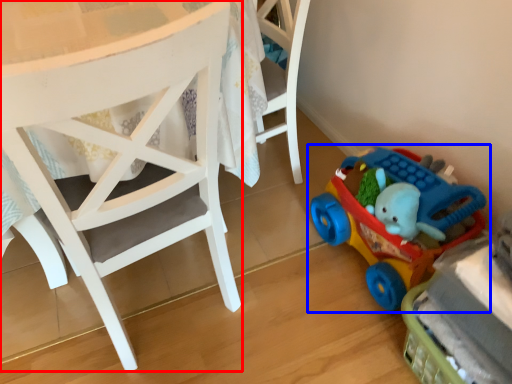
Question: Among these objects, which one is farthest to the camera, chair (highlighted by a red box) or toy (highlighted by a blue box)?

Choices:
 (A) chair
 (B) toy

Answer: (B)